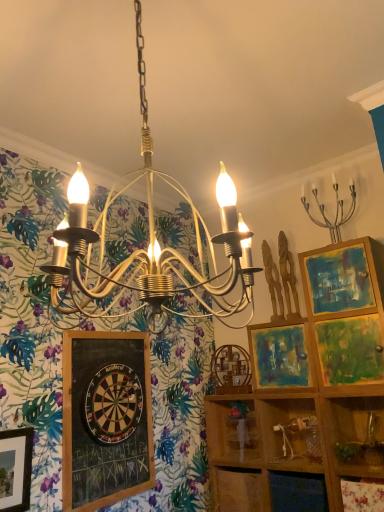
Question: From a real-world perspective, is wooden dartboard at center beneath matte wooden picture frame at center right?

Choices:
 (A) no
 (B) yes

Answer: (B)

Question: Is wooden dartboard at center touching matte wooden picture frame at center right?

Choices:
 (A) no
 (B) yes

Answer: (A)

Question: Can you confirm if wooden dartboard at center is positioned to the right of matte wooden picture frame at center right?

Choices:
 (A) yes
 (B) no

Answer: (B)

Question: Is wooden dartboard at center outside matte wooden picture frame at center right?

Choices:
 (A) yes
 (B) no

Answer: (A)

Question: Is wooden dartboard at center positioned behind matte wooden picture frame at center right?

Choices:
 (A) no
 (B) yes

Answer: (A)

Question: Can you confirm if wooden dartboard at center is bigger than matte wooden picture frame at center right?

Choices:
 (A) no
 (B) yes

Answer: (A)

Question: Considering the relative sizes of wooden shelf at lower right and black chalkboard at lower left in the image provided, is wooden shelf at lower right thinner than black chalkboard at lower left?

Choices:
 (A) yes
 (B) no

Answer: (B)

Question: Is wooden shelf at lower right aimed at black chalkboard at lower left?

Choices:
 (A) no
 (B) yes

Answer: (A)

Question: Is wooden shelf at lower right taller than black chalkboard at lower left?

Choices:
 (A) no
 (B) yes

Answer: (A)

Question: From a real-world perspective, is wooden shelf at lower right under black chalkboard at lower left?

Choices:
 (A) yes
 (B) no

Answer: (A)

Question: Is wooden shelf at lower right wider than black chalkboard at lower left?

Choices:
 (A) yes
 (B) no

Answer: (A)

Question: Is wooden shelf at lower right positioned beyond the bounds of black chalkboard at lower left?

Choices:
 (A) no
 (B) yes

Answer: (B)

Question: Does silver metallic candelabra at upper right have a greater width compared to black chalkboard at lower left?

Choices:
 (A) no
 (B) yes

Answer: (B)